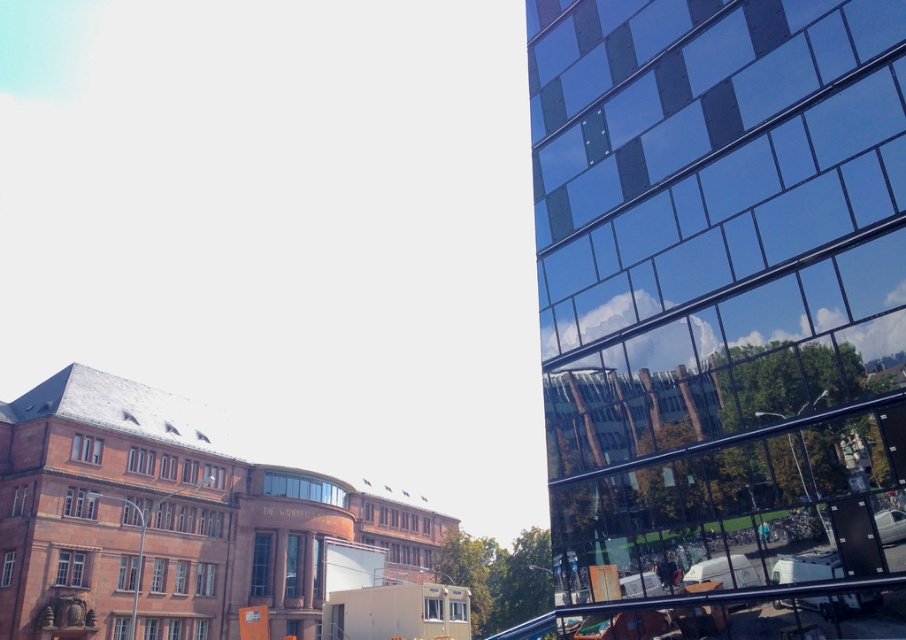
Question: Which point appears farthest from the camera in this image?

Choices:
 (A) (615, 598)
 (B) (681, 93)

Answer: (B)

Question: Can you confirm if reflective glass building at right is thinner than black glossy rail at lower right?

Choices:
 (A) yes
 (B) no

Answer: (B)

Question: Can you confirm if reflective glass building at right is smaller than black glossy rail at lower right?

Choices:
 (A) yes
 (B) no

Answer: (A)

Question: Among these objects, which one is farthest from the camera?

Choices:
 (A) reflective glass building at right
 (B) black glossy rail at lower right

Answer: (A)

Question: Can you confirm if reflective glass building at right is positioned to the right of black glossy rail at lower right?

Choices:
 (A) no
 (B) yes

Answer: (B)

Question: Which point is closer to the camera?

Choices:
 (A) black glossy rail at lower right
 (B) reflective glass building at right

Answer: (A)